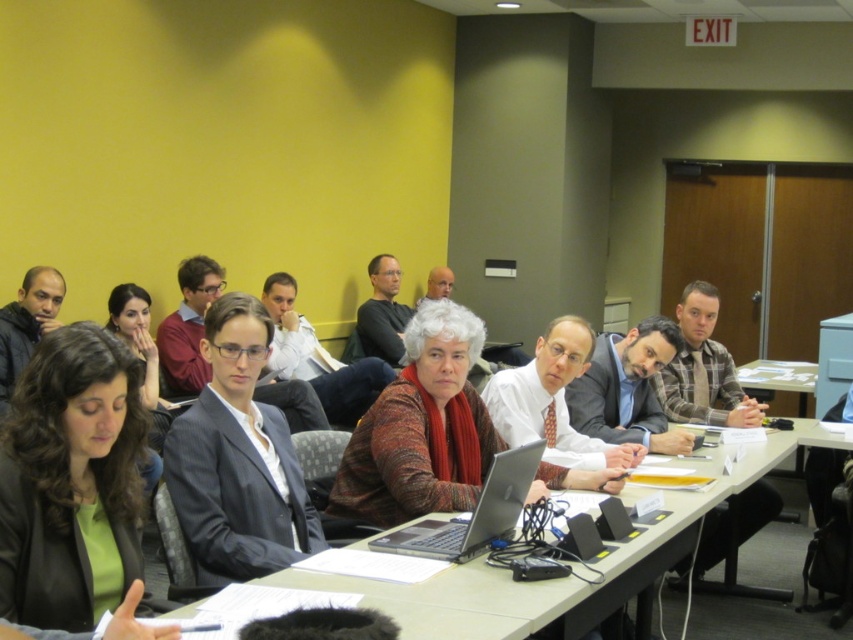
Between green matte blazer at lower left and light brown wooden table at center, which one appears on the right side from the viewer's perspective?

From the viewer's perspective, light brown wooden table at center appears more on the right side.

Image resolution: width=853 pixels, height=640 pixels. Identify the location of green matte blazer at lower left. (71, 483).

Between matte gray suit at center and silver metallic laptop at center, which one is positioned higher?

matte gray suit at center

Is matte gray suit at center below silver metallic laptop at center?

No.

Describe the element at coordinates (628, 388) in the screenshot. Image resolution: width=853 pixels, height=640 pixels. I see `matte gray suit at center` at that location.

Locate an element on the screen. The image size is (853, 640). matte gray suit at center is located at coordinates (628, 388).

Does point (395, 595) lie in front of point (570, 392)?

Yes, point (395, 595) is closer to viewer.

Is light brown wooden table at center positioned behind matte gray suit at center?

No.

Which is in front, point (735, 630) or point (669, 337)?

Point (669, 337)

Locate an element on the screen. The width and height of the screenshot is (853, 640). light brown wooden table at center is located at coordinates (544, 580).